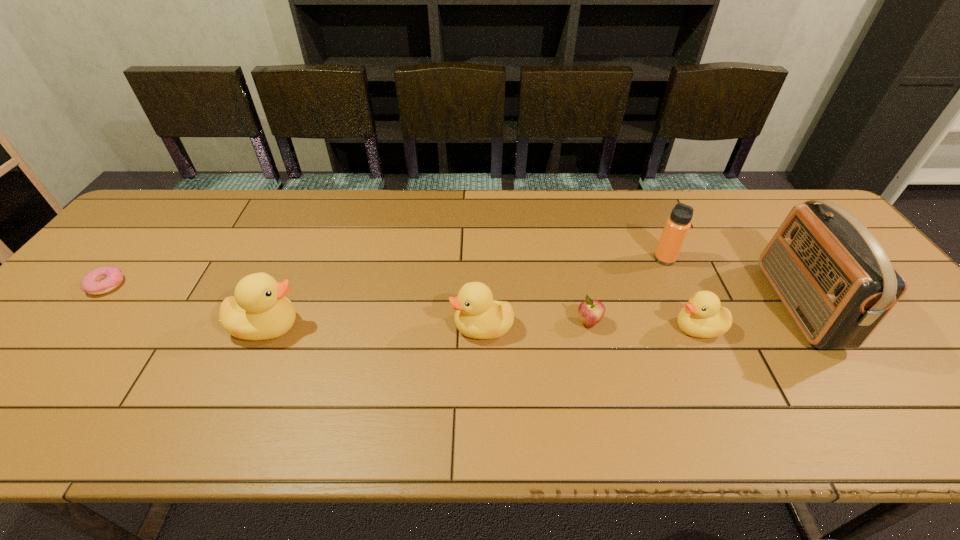
Locate an element on the screen. The width and height of the screenshot is (960, 540). vacant space located on the right of the doughnut is located at coordinates (192, 285).

I want to click on blank area located 0.340m on the front-facing side of the rightmost object, so click(x=645, y=305).

Find the location of a particular element. The height and width of the screenshot is (540, 960). free space located 0.080m on the front-facing side of the rightmost object is located at coordinates (747, 305).

Find the location of `blank area located 0.160m on the front-facing side of the rightmost object`. blank area located 0.160m on the front-facing side of the rightmost object is located at coordinates (x=715, y=305).

What are the coordinates of `vacant space located on the back of the sixth tallest object` in the screenshot? It's located at 575,264.

Where is `object situated at the left edge`? The height and width of the screenshot is (540, 960). object situated at the left edge is located at coordinates (102, 280).

Find the location of a particular element. Image resolution: width=960 pixels, height=540 pixels. free location at the far edge is located at coordinates (185, 233).

Identify the location of free location at the near edge. The width and height of the screenshot is (960, 540). (366, 370).

The height and width of the screenshot is (540, 960). Identify the location of free region at the far left corner of the desktop. [x=169, y=199].

Where is `vacant space at the near left corner of the desktop`? The image size is (960, 540). vacant space at the near left corner of the desktop is located at coordinates tap(39, 368).